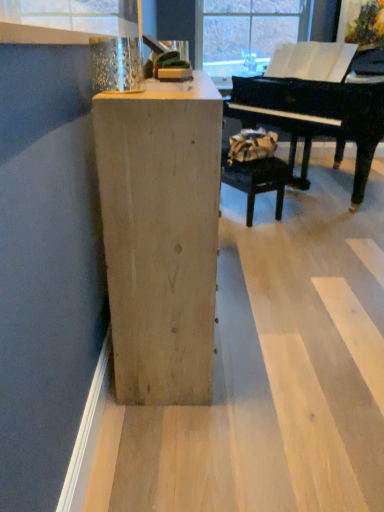
Where is `free space in front of leather-like brown bag at center`? This screenshot has width=384, height=512. free space in front of leather-like brown bag at center is located at coordinates (278, 240).